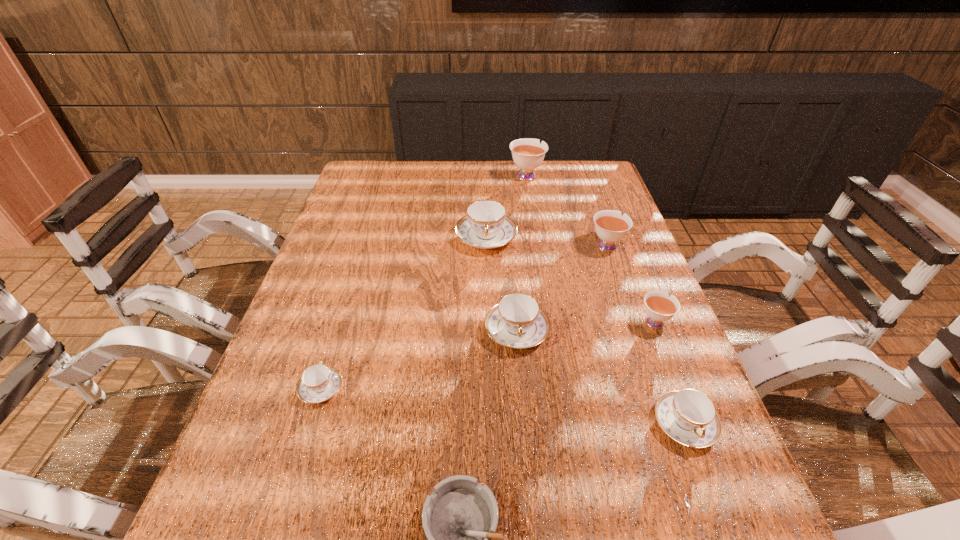
The image size is (960, 540). What are the coordinates of `vacant space situated on the side with the handle of the leftmost teacup` in the screenshot? It's located at (344, 315).

Where is `object that is at the far edge`? This screenshot has height=540, width=960. object that is at the far edge is located at coordinates (528, 153).

Where is `object positioned at the left edge`? The height and width of the screenshot is (540, 960). object positioned at the left edge is located at coordinates [x=319, y=382].

Locate an element on the screen. vacant area at the far edge is located at coordinates (407, 170).

Image resolution: width=960 pixels, height=540 pixels. I want to click on blank area at the left edge, so click(367, 275).

I want to click on free space at the right edge of the desktop, so click(x=711, y=460).

In the image, there is a desktop. Where is `free space at the far right corner`? free space at the far right corner is located at coordinates (568, 190).

The height and width of the screenshot is (540, 960). What are the coordinates of `empty space that is in between the leftmost object and the third smallest blue teacup` in the screenshot? It's located at (419, 360).

At what (x,y) coordinates should I click in order to perform the action: click on free space between the leftmost teacup and the biggest blue teacup. Please return your answer as a coordinate pair (x, y). Looking at the image, I should click on (403, 313).

What are the coordinates of `vacant point located between the second farthest white teacup and the rightmost blue teacup` in the screenshot? It's located at (645, 334).